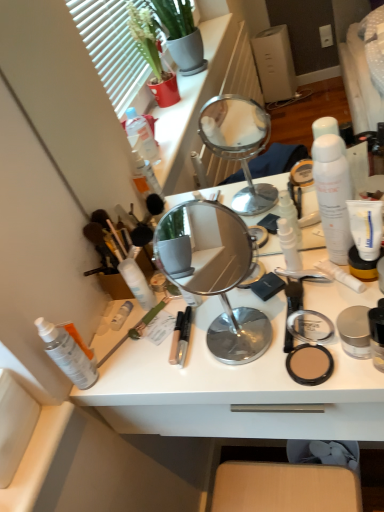
Question: Is white matte tube at right, acting as the first toothpaste starting from the top, inside or outside of white matte tube at right, the first toothpaste when ordered from bottom to top?

Choices:
 (A) inside
 (B) outside

Answer: (B)

Question: From the image's perspective, is white matte tube at right, the second toothpaste ordered from the bottom, positioned above or below white matte tube at right, the second toothpaste viewed from the top?

Choices:
 (A) above
 (B) below

Answer: (A)

Question: Which object is the closest to the white matte lotion at center, the 5th toiletry when ordered from left to right?

Choices:
 (A) white matte spray can at left, marked as the fifth toiletry in a right-to-left arrangement
 (B) green matte brush at center
 (C) white matte spray can at center, which is the fourth toiletry in left-to-right order
 (D) white plastic desk at center
 (E) matte beige compact at right

Answer: (E)

Question: Estimate the real-world distances between objects in this image. Which object is farther from the white matte spray can at left, marked as the fifth toiletry in a right-to-left arrangement?

Choices:
 (A) matte beige compact at right
 (B) white matte tube at right, the second toothpaste ordered from the bottom
 (C) white matte lotion at center, which is counted as the 4th toiletry, starting from the right
 (D) white matte spray can at upper right, acting as the first toiletry starting from the right
 (E) white matte spray can at center, which is the third toiletry in right-to-left order

Answer: (B)